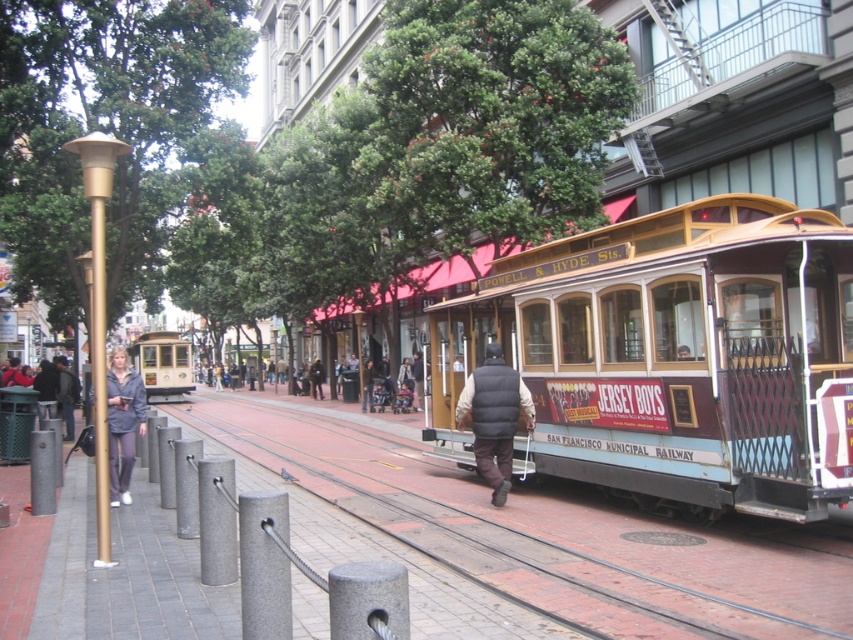
Question: Estimate the real-world distances between objects in this image. Which object is farther from the brick train track at center?

Choices:
 (A) dark brown leather jacket at center
 (B) gray fabric jacket at lower left

Answer: (A)

Question: Can you confirm if wooden polished cable car at center is positioned to the right of dark gray jacket at left?

Choices:
 (A) no
 (B) yes

Answer: (B)

Question: Is gray fabric jacket at lower left closer to camera compared to dark brown leather jacket at center?

Choices:
 (A) no
 (B) yes

Answer: (B)

Question: Among these objects, which one is nearest to the camera?

Choices:
 (A) dark gray jacket at center
 (B) dark gray jacket at left

Answer: (B)

Question: Which point is closer to the camera?

Choices:
 (A) (698, 225)
 (B) (138, 433)
 (C) (527, 406)

Answer: (A)

Question: Does matte gold cable car at center appear on the left side of dark gray jacket at center?

Choices:
 (A) no
 (B) yes

Answer: (B)